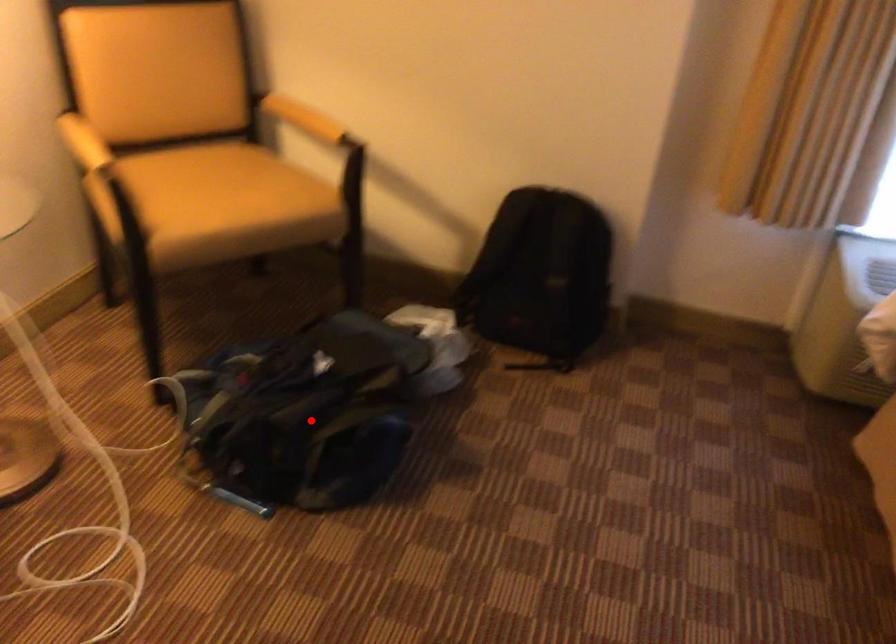
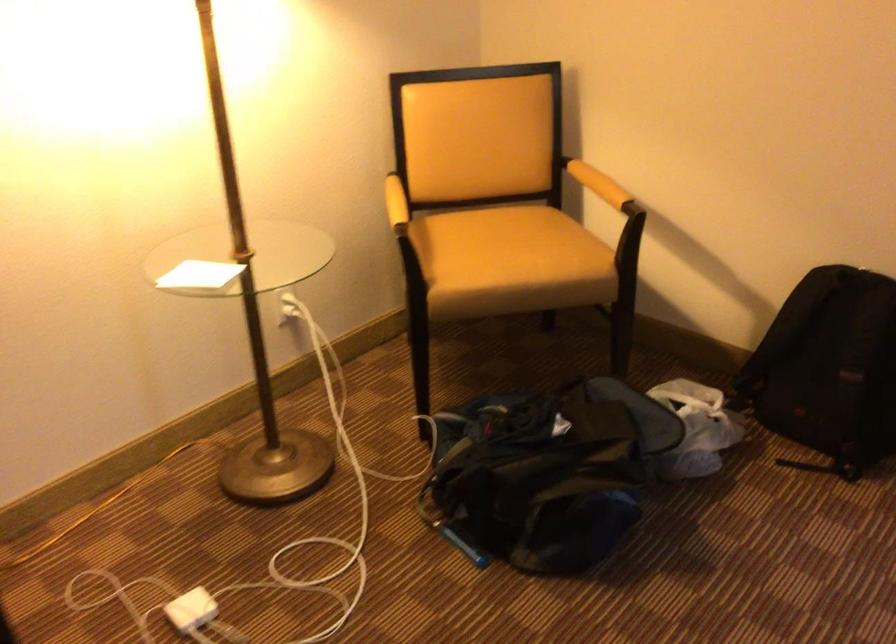
Where in the second image is the point corresponding to the highlighted location from the first image?

(537, 480)